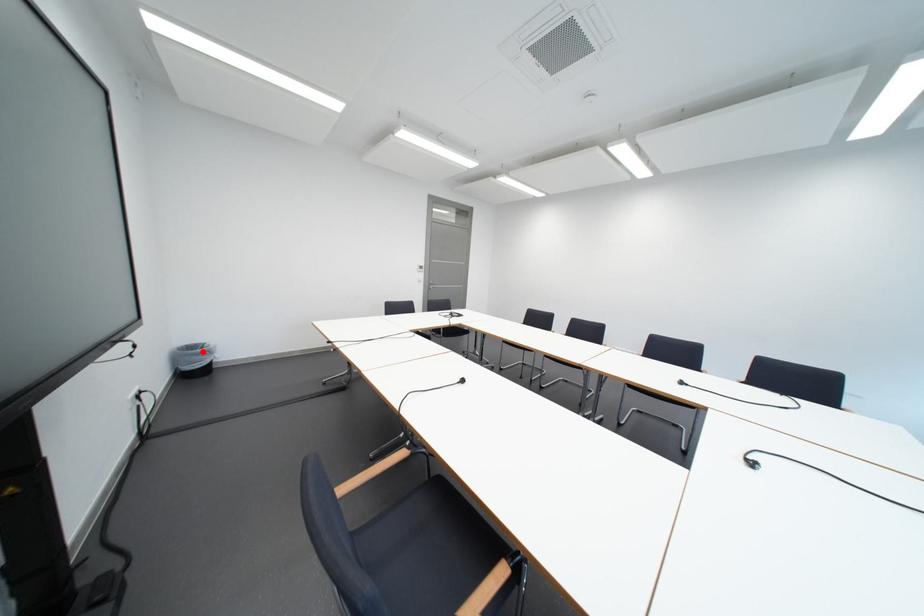
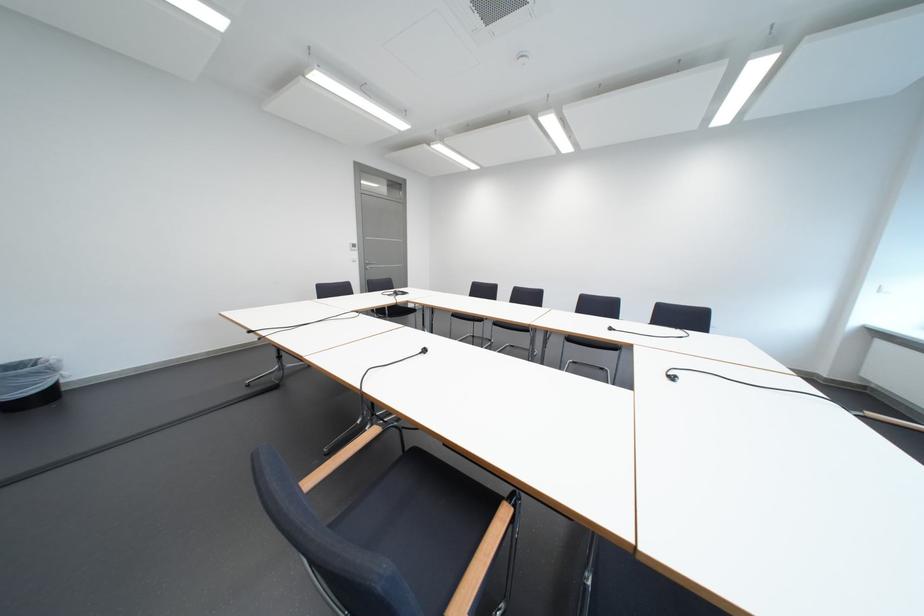
Question: A red point is marked in image1. In image2, is the corresponding 3D point closer to the camera or farther? Reply with the corresponding letter.

Choices:
 (A) The corresponding 3D point is closer.
 (B) The corresponding 3D point is farther.

Answer: (B)